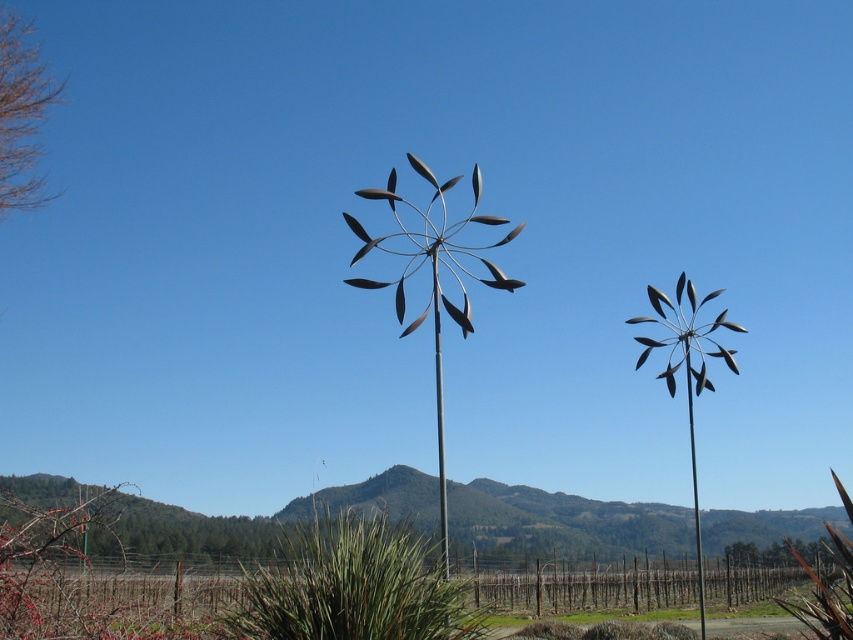
Question: Does metallic silver windmill at right appear on the right side of metallic pole at center?

Choices:
 (A) yes
 (B) no

Answer: (A)

Question: Is metallic silver windmill at right closer to the viewer compared to metallic pole at center?

Choices:
 (A) no
 (B) yes

Answer: (A)

Question: Which of these objects is positioned closest to the metallic pole at center?

Choices:
 (A) metallic silver windmill at center
 (B) metallic silver windmill at right

Answer: (B)

Question: Among these objects, which one is nearest to the camera?

Choices:
 (A) metallic silver windmill at center
 (B) metallic silver windmill at right

Answer: (A)

Question: Estimate the real-world distances between objects in this image. Which object is closer to the metallic pole at center?

Choices:
 (A) metallic silver windmill at center
 (B) metallic silver windmill at right

Answer: (B)

Question: Is metallic silver windmill at center above metallic silver windmill at right?

Choices:
 (A) yes
 (B) no

Answer: (A)